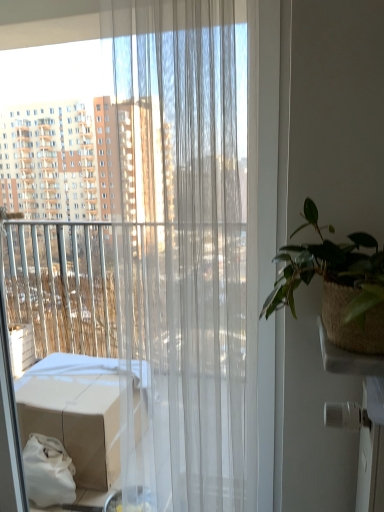
Question: From their relative heights in the image, would you say translucent white curtain at center is taller or shorter than green woven pot at right?

Choices:
 (A) short
 (B) tall

Answer: (B)

Question: From a real-world perspective, is translucent white curtain at center positioned above or below green woven pot at right?

Choices:
 (A) above
 (B) below

Answer: (B)

Question: From the image's perspective, relative to green woven pot at right, is translucent white curtain at center above or below?

Choices:
 (A) above
 (B) below

Answer: (B)

Question: Is green woven pot at right to the left or to the right of translucent white curtain at center in the image?

Choices:
 (A) right
 (B) left

Answer: (A)

Question: Considering the positions of green woven pot at right and translucent white curtain at center in the image, is green woven pot at right taller or shorter than translucent white curtain at center?

Choices:
 (A) tall
 (B) short

Answer: (B)

Question: From the image's perspective, is green woven pot at right positioned above or below translucent white curtain at center?

Choices:
 (A) below
 (B) above

Answer: (B)

Question: Is green woven pot at right inside or outside of translucent white curtain at center?

Choices:
 (A) inside
 (B) outside

Answer: (B)